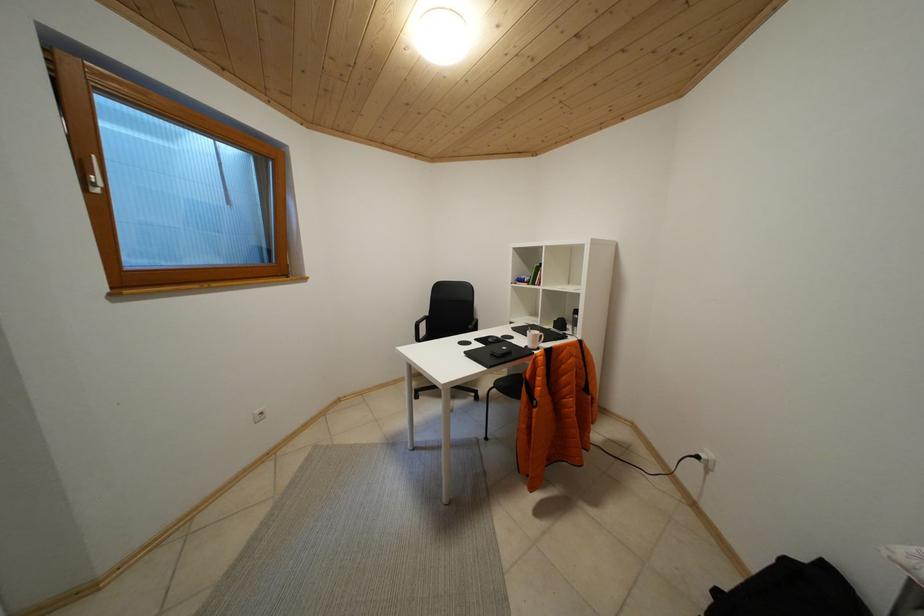
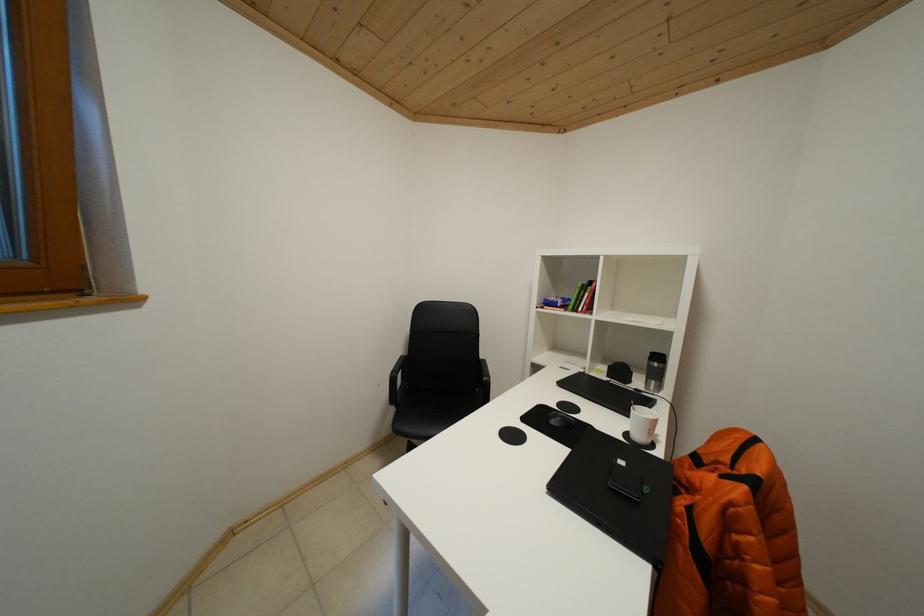
Question: The camera is either moving clockwise (left) or counter-clockwise (right) around the object. The first image is from the beginning of the video and the second image is from the end. Is the camera moving left or right when shooting the video?

Choices:
 (A) Left
 (B) Right

Answer: (A)